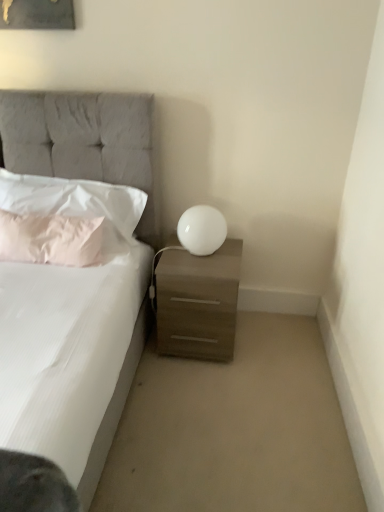
At what (x,y) coordinates should I click in order to perform the action: click on space that is in front of matte wood nightstand at lower right. Please return your answer as a coordinate pair (x, y). The width and height of the screenshot is (384, 512). Looking at the image, I should click on (199, 392).